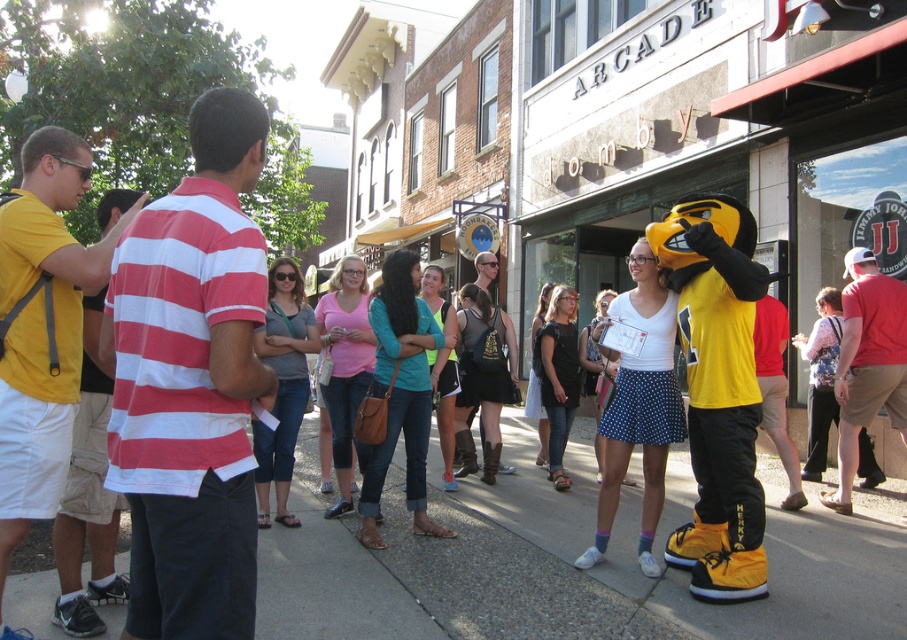
Between point (164, 216) and point (884, 278), which one is positioned in front?

Point (164, 216) is in front.

Between red and white striped polo shirt at left and red cotton t-shirt at right, which one has more height?

red cotton t-shirt at right

Does point (134, 483) come closer to viewer compared to point (888, 394)?

That is True.

Where is `red and white striped polo shirt at left`? This screenshot has width=907, height=640. red and white striped polo shirt at left is located at coordinates (191, 381).

This screenshot has height=640, width=907. What are the coordinates of `red cotton t-shirt at right` in the screenshot? It's located at (866, 362).

Between red cotton t-shirt at right and denim shorts at center, which one has more height?

Standing taller between the two is red cotton t-shirt at right.

Describe the element at coordinates (866, 362) in the screenshot. The width and height of the screenshot is (907, 640). I see `red cotton t-shirt at right` at that location.

The image size is (907, 640). I want to click on red cotton t-shirt at right, so click(x=866, y=362).

Who is positioned more to the right, gray concrete sidewalk at center or yellow matte shirt at left?

From the viewer's perspective, gray concrete sidewalk at center appears more on the right side.

Is gray concrete sidewalk at center below yellow matte shirt at left?

Yes, gray concrete sidewalk at center is below yellow matte shirt at left.

Between point (852, 538) and point (0, 227), which one is positioned in front?

Point (0, 227)

The image size is (907, 640). I want to click on gray concrete sidewalk at center, so click(x=563, y=570).